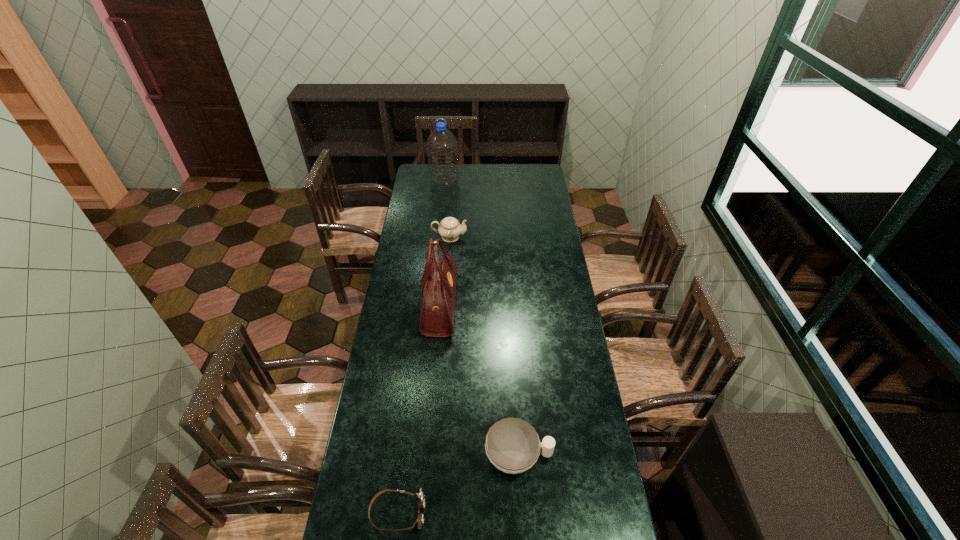
Identify the location of blank space located at the spout of the farther chinaware. (538, 237).

You are a GUI agent. You are given a task and a screenshot of the screen. Output one action in this format:
    pyautogui.click(x=<x>, y=<y>)
    Task: Click on the vacant space located on the side with the handle of the fourth farthest object
    This screenshot has width=960, height=540.
    Given the screenshot: What is the action you would take?
    pyautogui.click(x=567, y=456)

This screenshot has height=540, width=960. In order to click on vacant space situated on the front-facing side of the goggles in this screenshot , I will do `click(544, 513)`.

This screenshot has height=540, width=960. Find the location of `object that is at the far edge`. object that is at the far edge is located at coordinates (442, 146).

This screenshot has width=960, height=540. Find the location of `water jug that is at the left edge`. water jug that is at the left edge is located at coordinates (442, 146).

Find the location of a particular element. Image resolution: width=960 pixels, height=540 pixels. chinaware that is at the left edge is located at coordinates (450, 229).

Where is `goggles that is positioned at the left edge`? goggles that is positioned at the left edge is located at coordinates (420, 497).

Locate an element on the screen. The width and height of the screenshot is (960, 540). object located at the far left corner is located at coordinates (442, 146).

Find the location of a particular element. blank area at the far edge is located at coordinates (460, 169).

The image size is (960, 540). In order to click on free region at the left edge in this screenshot , I will do `click(356, 464)`.